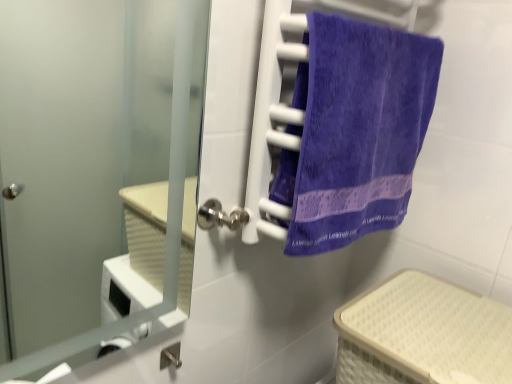
Question: Is satin silver door at center shorter than beige woven basket at lower right?

Choices:
 (A) yes
 (B) no

Answer: (B)

Question: From a real-world perspective, is satin silver door at center positioned under beige woven basket at lower right based on gravity?

Choices:
 (A) yes
 (B) no

Answer: (B)

Question: Can you confirm if satin silver door at center is positioned to the left of beige woven basket at lower right?

Choices:
 (A) no
 (B) yes

Answer: (B)

Question: Can you confirm if satin silver door at center is taller than beige woven basket at lower right?

Choices:
 (A) no
 (B) yes

Answer: (B)

Question: Are satin silver door at center and beige woven basket at lower right beside each other?

Choices:
 (A) yes
 (B) no

Answer: (B)

Question: Visually, is purple terry cloth towel at right positioned to the left or to the right of beige woven basket at lower right?

Choices:
 (A) right
 (B) left

Answer: (B)

Question: From the image's perspective, is purple terry cloth towel at right positioned above or below beige woven basket at lower right?

Choices:
 (A) above
 (B) below

Answer: (A)

Question: Would you say purple terry cloth towel at right is inside or outside beige woven basket at lower right?

Choices:
 (A) inside
 (B) outside

Answer: (B)

Question: Considering the positions of purple terry cloth towel at right and beige woven basket at lower right in the image, is purple terry cloth towel at right bigger or smaller than beige woven basket at lower right?

Choices:
 (A) small
 (B) big

Answer: (A)

Question: From the image's perspective, is purple terry cloth towel at right located above or below satin silver door at center?

Choices:
 (A) above
 (B) below

Answer: (A)

Question: From a real-world perspective, relative to satin silver door at center, is purple terry cloth towel at right vertically above or below?

Choices:
 (A) below
 (B) above

Answer: (B)

Question: In the image, is purple terry cloth towel at right positioned in front of or behind satin silver door at center?

Choices:
 (A) behind
 (B) front

Answer: (A)

Question: Is purple terry cloth towel at right wider or thinner than satin silver door at center?

Choices:
 (A) thin
 (B) wide

Answer: (B)

Question: Relative to purple terry cloth towel at right, is satin silver door at center in front or behind?

Choices:
 (A) front
 (B) behind

Answer: (A)

Question: From a real-world perspective, is satin silver door at center physically located above or below purple terry cloth towel at right?

Choices:
 (A) above
 (B) below

Answer: (B)